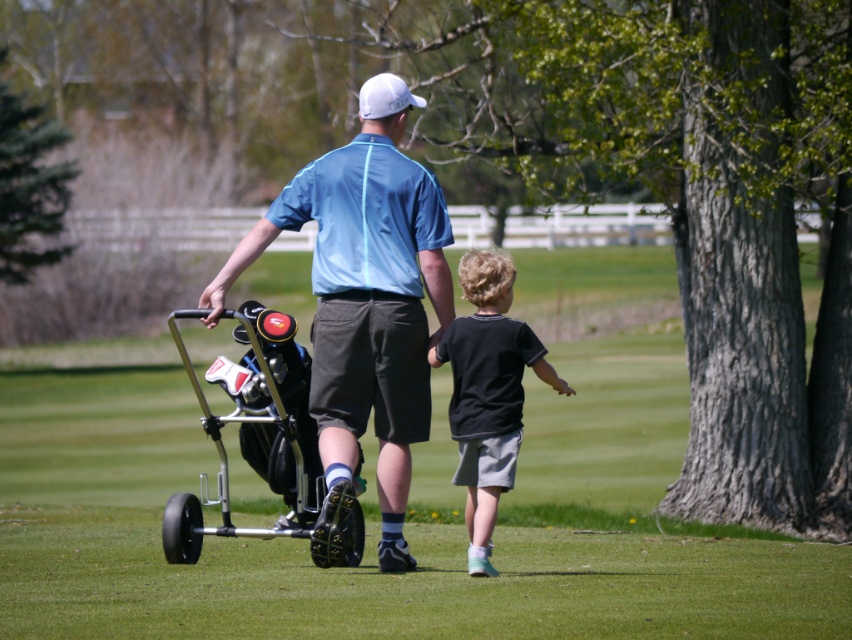
You are standing at the starting point of the golf course and see two points marked in the scene. The first point is labeled as point [398,160] and the second is point [252,435]. If you want to reach the point that is closer to you, which one should you head towards?

Point [398,160] is in front of point [252,435], so you should head towards point [398,160] to reach the one closer to you.

You are a drone operator trying to capture a photo of the metallic silver golf cart at center from above. What are the coordinates you should aim for?

The metallic silver golf cart at center is located at coordinates (x=263, y=413).